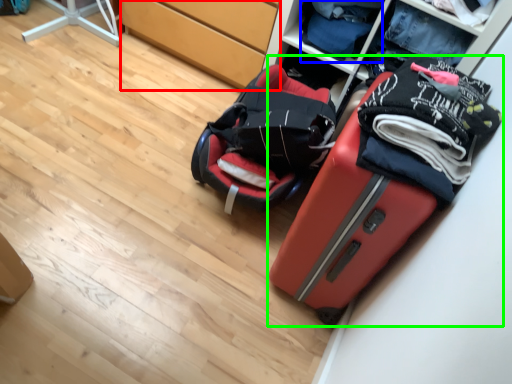
Question: Estimate the real-world distances between objects in this image. Which object is closer to cabinetry (highlighted by a red box), clothing (highlighted by a blue box) or suitcase (highlighted by a green box)?

Choices:
 (A) clothing
 (B) suitcase

Answer: (A)